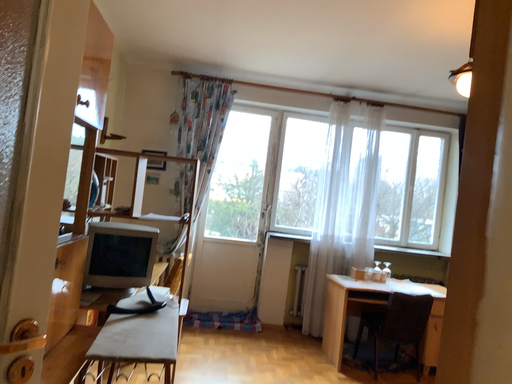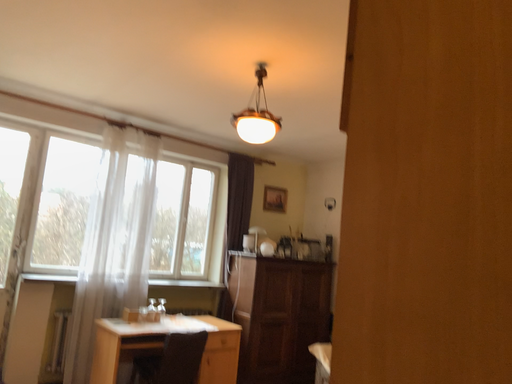
Question: How did the camera likely rotate when shooting the video?

Choices:
 (A) rotated left
 (B) rotated right

Answer: (B)